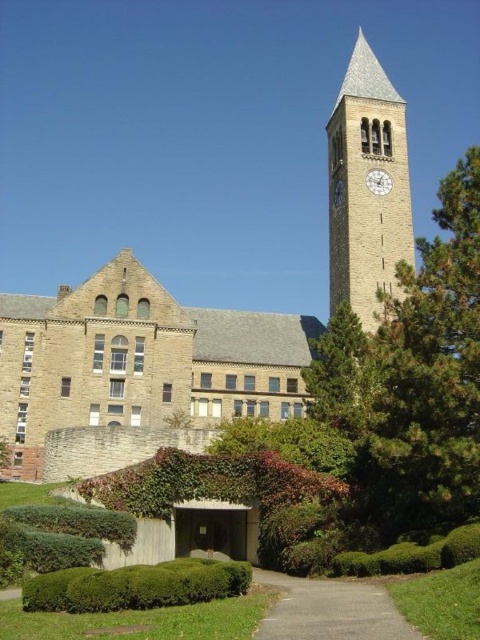
Question: Does sandstone clock tower at upper right appear under green leafy hedge at lower center?

Choices:
 (A) yes
 (B) no

Answer: (B)

Question: Among these points, which one is farthest from the camera?

Choices:
 (A) (379, 173)
 (B) (110, 301)
 (C) (197, 570)
 (D) (361, 486)

Answer: (A)

Question: Is brown stone church at center above gold metallic clock at upper right?

Choices:
 (A) no
 (B) yes

Answer: (A)

Question: Which point appears closest to the camera in this image?

Choices:
 (A) (363, 417)
 (B) (372, 172)

Answer: (A)

Question: In this image, where is brown stone church at center located relative to gold metallic clock at upper right?

Choices:
 (A) above
 (B) below

Answer: (B)

Question: Estimate the real-world distances between objects in this image. Which object is closer to the gold metallic clock at upper right?

Choices:
 (A) sandstone clock tower at upper right
 (B) gravel path at lower center
 (C) brown stone church at center
 (D) beige stone church at center

Answer: (A)